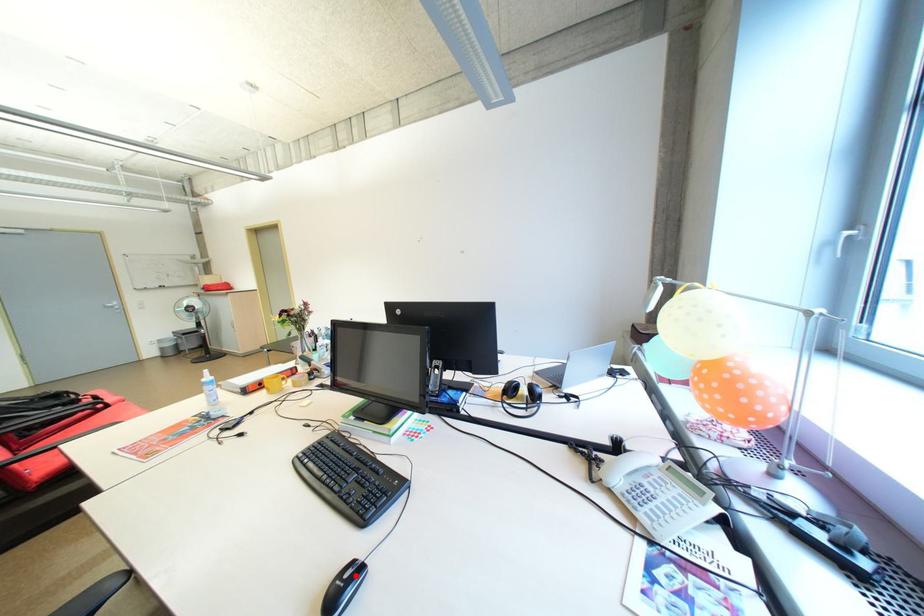
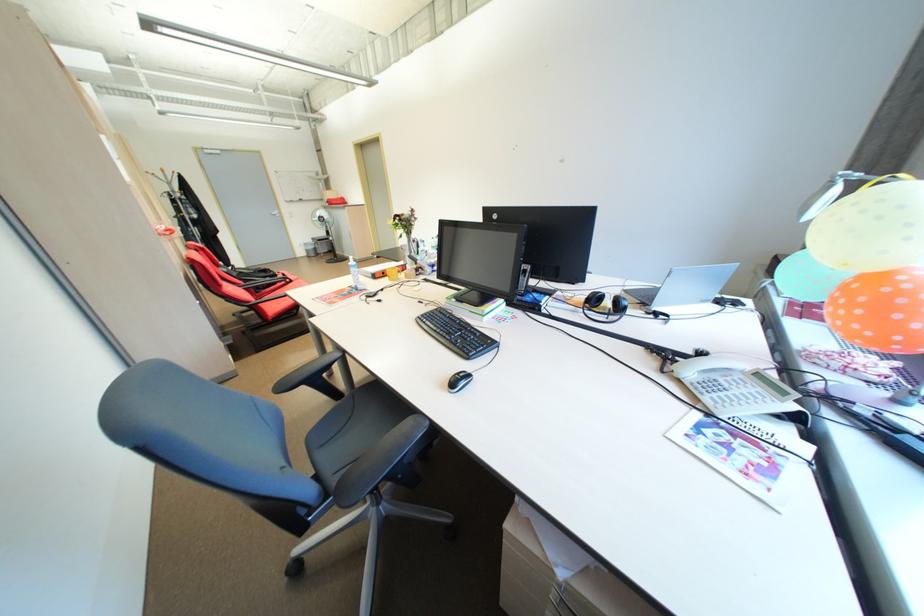
Where in the second image is the point corresponding to the highlighted location from the first image?

(469, 376)